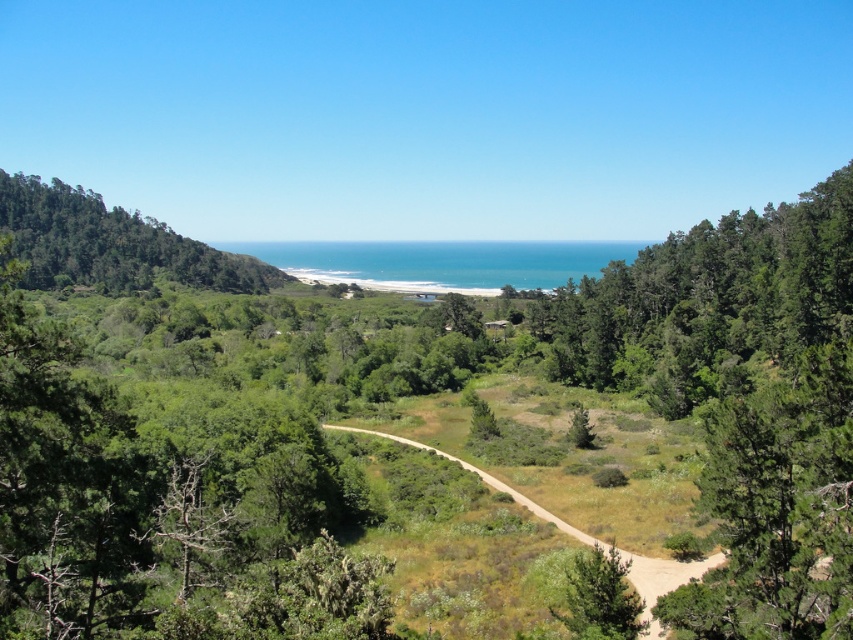
Question: Based on their relative distances, which object is nearer to the green leafy trees at left?

Choices:
 (A) green matte tree at center
 (B) green leafy tree at center

Answer: (B)

Question: Which object is the closest to the green matte tree at center?

Choices:
 (A) brown dirt path at center
 (B) green leafy trees at left

Answer: (A)

Question: Does green leafy trees at left have a greater width compared to brown dirt path at center?

Choices:
 (A) no
 (B) yes

Answer: (B)

Question: Observing the image, what is the correct spatial positioning of green leafy tree at center in reference to brown dirt path at center?

Choices:
 (A) left
 (B) right

Answer: (A)

Question: Among these objects, which one is nearest to the camera?

Choices:
 (A) green leafy tree at center
 (B) brown dirt path at center
 (C) green matte tree at center
 (D) green leafy trees at left

Answer: (A)

Question: From the image, what is the correct spatial relationship of green leafy tree at center in relation to green leafy trees at left?

Choices:
 (A) below
 (B) above

Answer: (A)